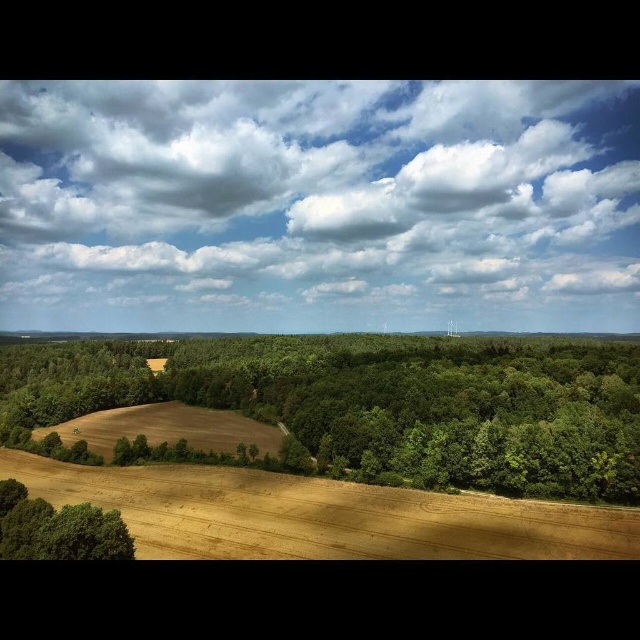
You are an artist painting the rural landscape. You want to place a small birdhouse exactly halfway between the white fluffy cloud at upper center and the green leafy tree at lower left. Based on the scene, can you determine if the birdhouse will be closer to the fields or the forested areas?

The birdhouse will be closer to the fields because the white fluffy cloud at upper center is positioned on the right side of green leafy tree at lower left, meaning the midpoint between them would still be in the open fields area rather than near the forested regions.

You are an airplane pilot flying over a rural area. You notice a white fluffy cloud at upper center and a green leafy tree at lower left. Which object appears taller from your perspective?

The white fluffy cloud at upper center appears taller than the green leafy tree at lower left from your perspective.